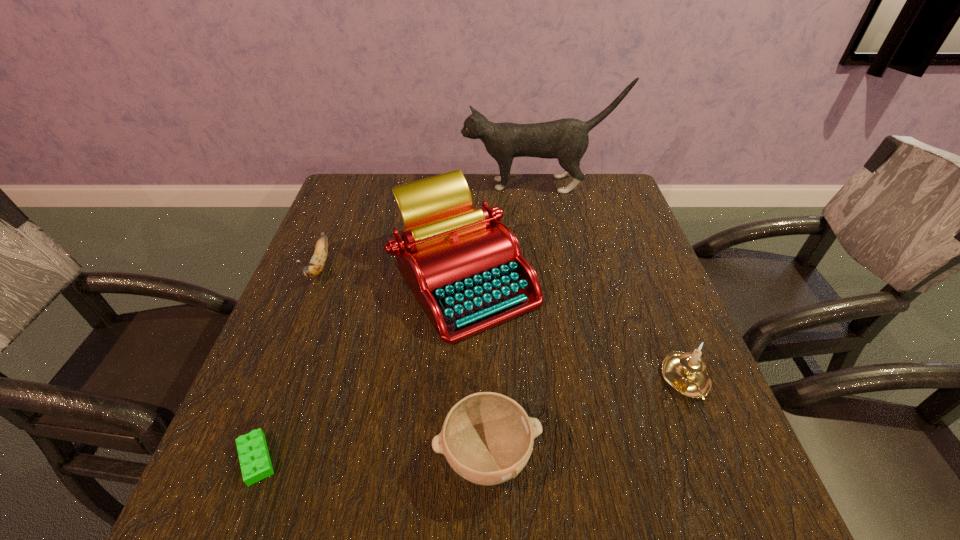
Find the location of a particular element. The image size is (960, 540). free region that satisfies the following two spatial constraints: 1. at the stem of the bowl; 2. on the left side of the banana is located at coordinates (244, 456).

Identify the location of vacant space that satisfies the following two spatial constraints: 1. at the stem of the Lego; 2. on the left side of the banana. (243, 459).

This screenshot has width=960, height=540. What are the coordinates of `free location that satisfies the following two spatial constraints: 1. at the face of the tallest object; 2. at the stem of the banana` in the screenshot? It's located at (553, 266).